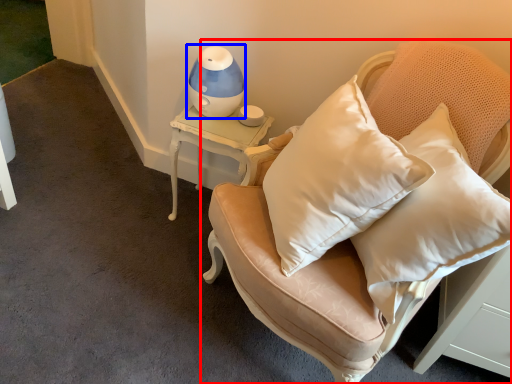
Question: Which of the following is the farthest to the observer, furniture (highlighted by a red box) or table lamp (highlighted by a blue box)?

Choices:
 (A) furniture
 (B) table lamp

Answer: (B)